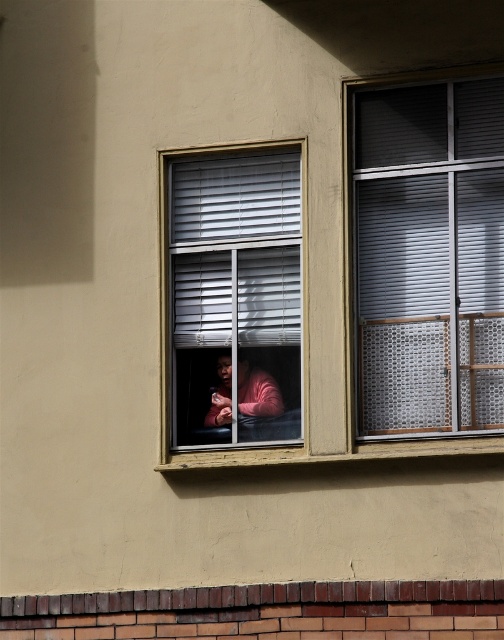
Question: Is metallic silver blinds at upper right behind matte plastic window at center?

Choices:
 (A) no
 (B) yes

Answer: (A)

Question: Which point is closer to the camera?

Choices:
 (A) (209, 284)
 (B) (248, 396)

Answer: (B)

Question: Can you confirm if matte plastic window at center is positioned to the right of pink matte sweater at center?

Choices:
 (A) yes
 (B) no

Answer: (B)

Question: Which of the following is the farthest from the observer?

Choices:
 (A) matte plastic window at center
 (B) pink matte sweater at center

Answer: (B)

Question: Does metallic silver blinds at upper right lie behind matte plastic window at center?

Choices:
 (A) no
 (B) yes

Answer: (A)

Question: Which of these objects is positioned closest to the metallic silver blinds at upper right?

Choices:
 (A) pink matte sweater at center
 (B) matte plastic window at center

Answer: (B)